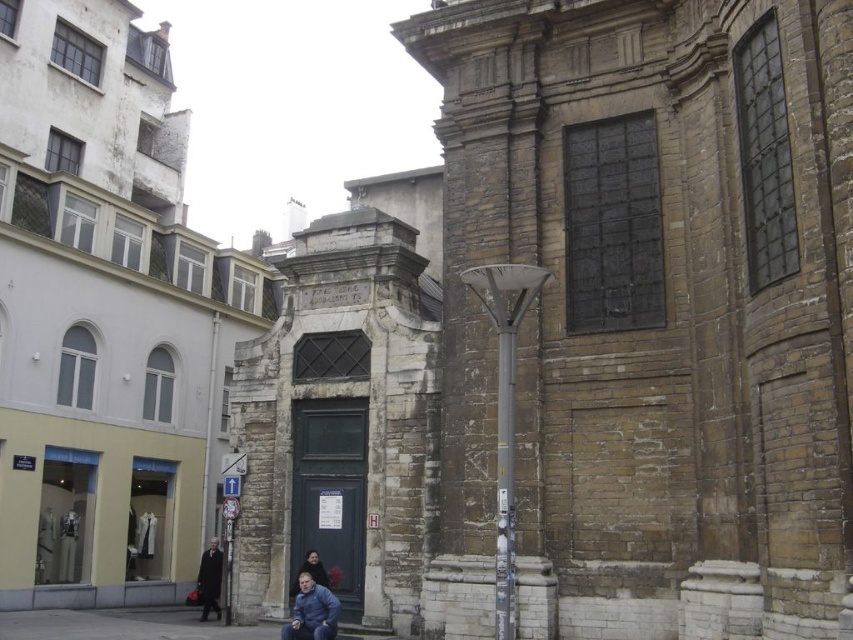
Question: Which of the following is the closest to the observer?

Choices:
 (A) dark brown leather jacket at lower center
 (B) blue denim jacket at lower center

Answer: (B)

Question: Is the position of blue denim jacket at lower center more distant than that of dark brown leather jacket at lower center?

Choices:
 (A) yes
 (B) no

Answer: (B)

Question: Among these points, which one is farthest from the camera?

Choices:
 (A) (33, 614)
 (B) (209, 584)
 (C) (291, 589)

Answer: (B)

Question: Based on their relative distances, which object is nearer to the gray concrete pavement at lower center?

Choices:
 (A) dark brown leather jacket at lower center
 (B) dark brown leather coat at lower left
 (C) blue denim jacket at lower center

Answer: (B)

Question: From the image, what is the correct spatial relationship of gray concrete pavement at lower center in relation to blue denim jacket at lower center?

Choices:
 (A) left
 (B) right

Answer: (A)

Question: Where is blue denim jacket at lower center located in relation to dark brown leather coat at lower left in the image?

Choices:
 (A) left
 (B) right

Answer: (B)